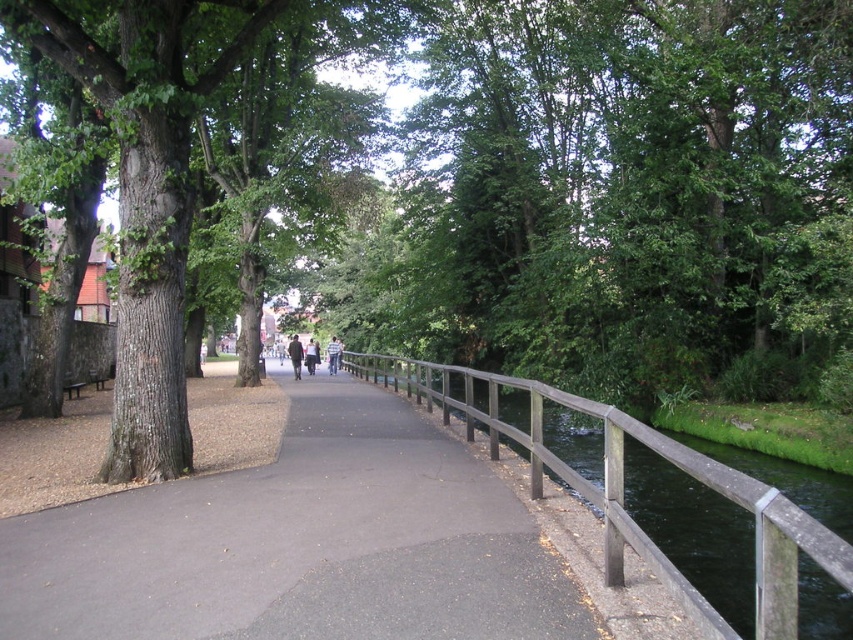
Does dark gray jacket at center have a smaller size compared to light brown leather jacket at center?

No.

This screenshot has width=853, height=640. Describe the element at coordinates (294, 355) in the screenshot. I see `dark gray jacket at center` at that location.

Who is more forward, [299,349] or [312,371]?

Point [299,349] is more forward.

The image size is (853, 640). I want to click on dark gray jacket at center, so click(x=294, y=355).

Does wooden rail at right have a greater width compared to light brown leather jacket at center?

Yes.

Does wooden rail at right have a lesser width compared to light brown leather jacket at center?

Incorrect, wooden rail at right's width is not less than light brown leather jacket at center's.

What do you see at coordinates (624, 490) in the screenshot? I see `wooden rail at right` at bounding box center [624, 490].

I want to click on wooden rail at right, so 624,490.

In the scene shown: Who is more forward, (393, 365) or (329, 369)?

Point (393, 365) is more forward.

Does wooden rail at right lie behind dark brown leather jacket at center?

That is False.

Where is `wooden rail at right`? wooden rail at right is located at coordinates (624, 490).